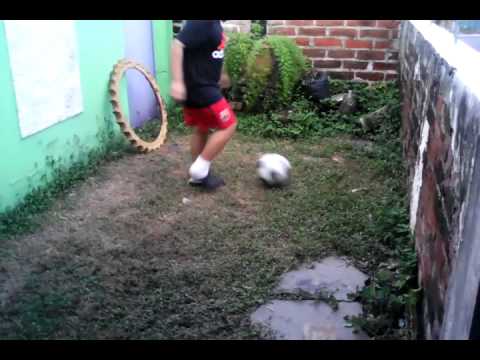
Locate an element on the screen. Image resolution: width=480 pixels, height=360 pixels. plant is located at coordinates (379, 328).